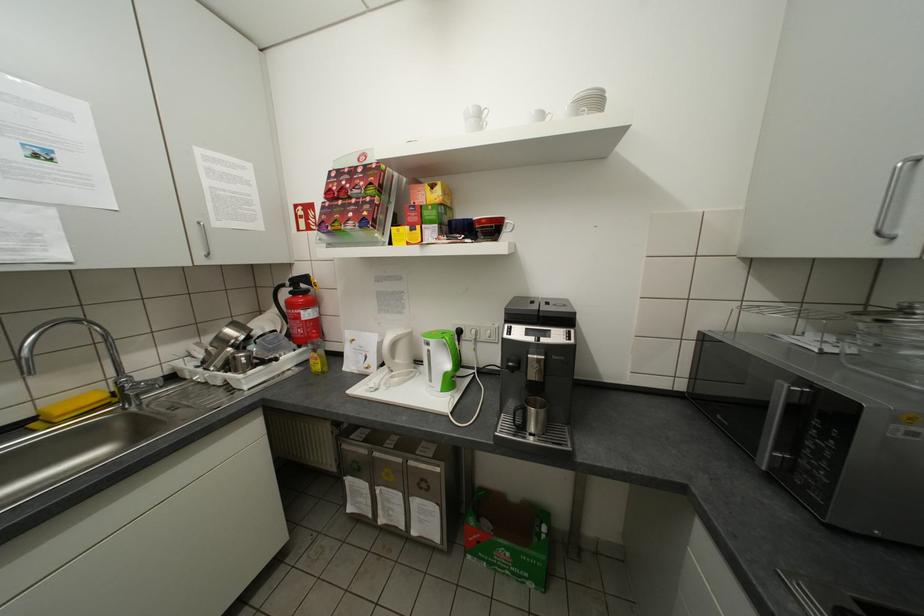
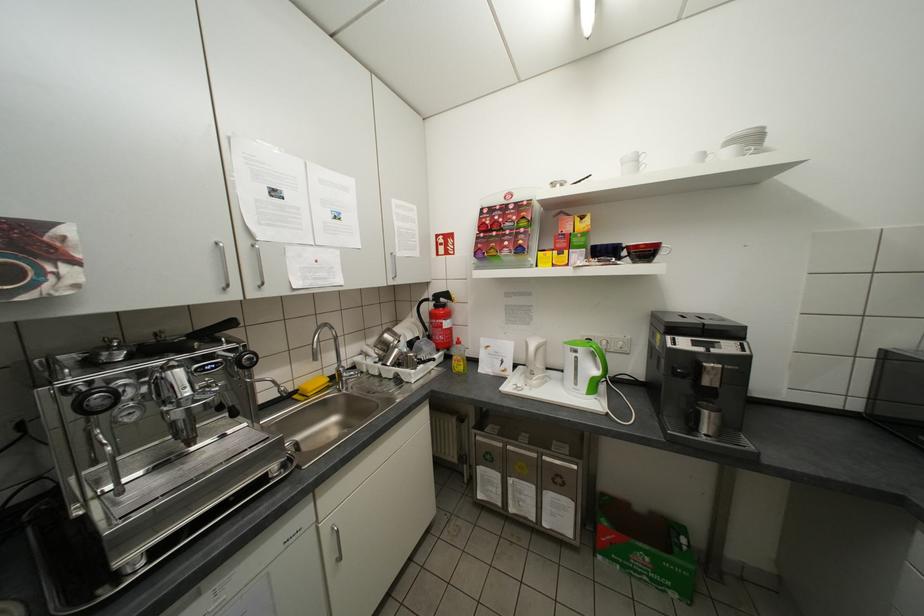
Locate, in the second image, the point that corresponds to the point at 453,237 in the first image.

(603, 259)